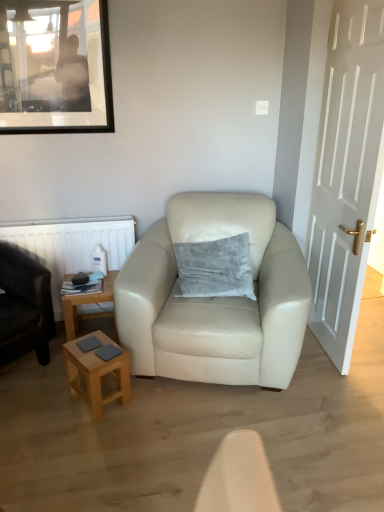
At what (x,y) coordinates should I click in order to perform the action: click on free point above light brown wooden stool at lower left (from a real-world perspective). Please return your answer as a coordinate pair (x, y). The width and height of the screenshot is (384, 512). Looking at the image, I should click on (100, 348).